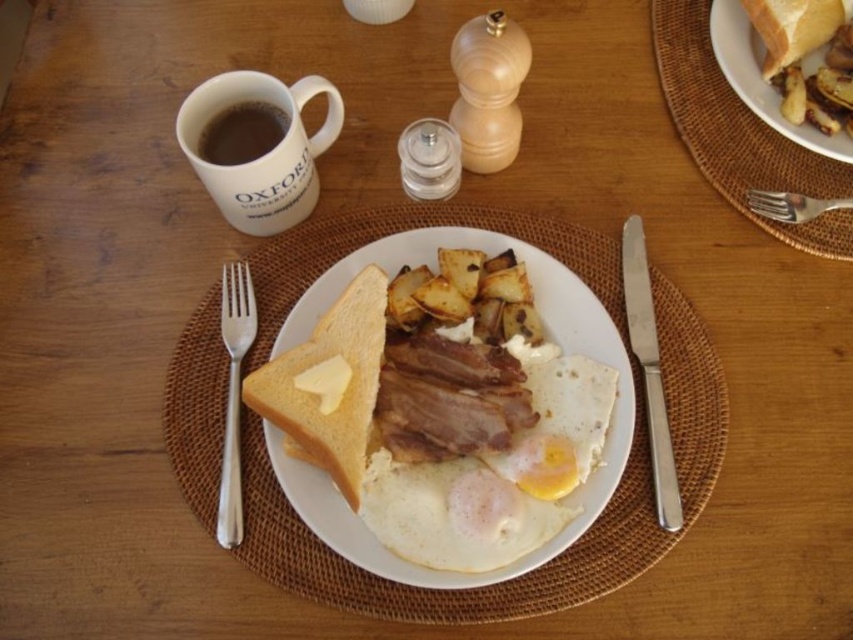
You are sitting at the wooden table and want to grab the smooth white egg at center. However, the white ceramic mug at upper left is blocking your path. Can you reach the egg without moving the mug?

The white ceramic mug at upper left is further to the viewer than the smooth white egg at center, so the mug is closer to you. Since the mug is closer, it is blocking your path to the egg. To reach the egg, you would need to move the mug out of the way first.

You are standing at the edge of the table and want to reach both the point at coordinates point (764, 106) and point (791, 218). Which point is closer to you?

Point (791, 218) is closer to you because it is in front of point (764, 106).